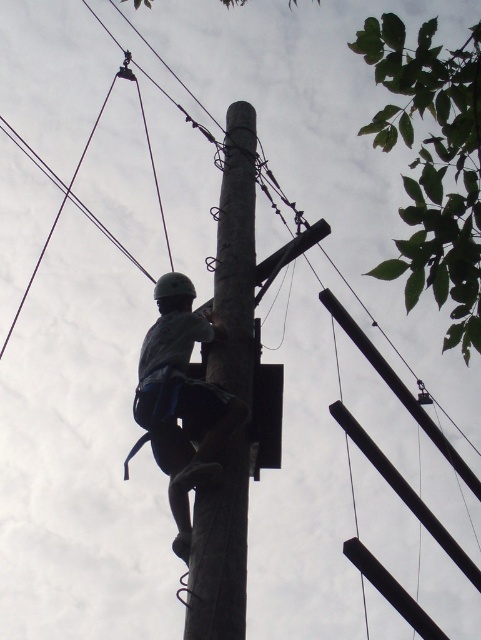
You are a safety inspector reviewing this image. The smooth wooden pole at center is part of a critical infrastructure system. Based on its coordinates, is it positioned centrally within the image frame?

The smooth wooden pole at center is located at coordinates point (x=236, y=257), which is near the center of the image frame. Therefore, it is positioned centrally within the image frame.

You are a safety inspector assessing the setup of the smooth wooden pole at center and the matte black helmet at center. Based on standard safety protocols, which object should be checked for proper fit and stability?

The matte black helmet at center should be checked for proper fit and stability as it is a personal protective equipment, while the smooth wooden pole at center is part of the structural setup and would have its own safety checks.

Based on the photo, you are a safety inspector assessing the setup of the worker in the image. Based on the scene, does the smooth wooden pole at center block the matte black helmet at center from direct sunlight?

The smooth wooden pole at center is positioned over matte black helmet at center, so it would block the helmet from direct sunlight.